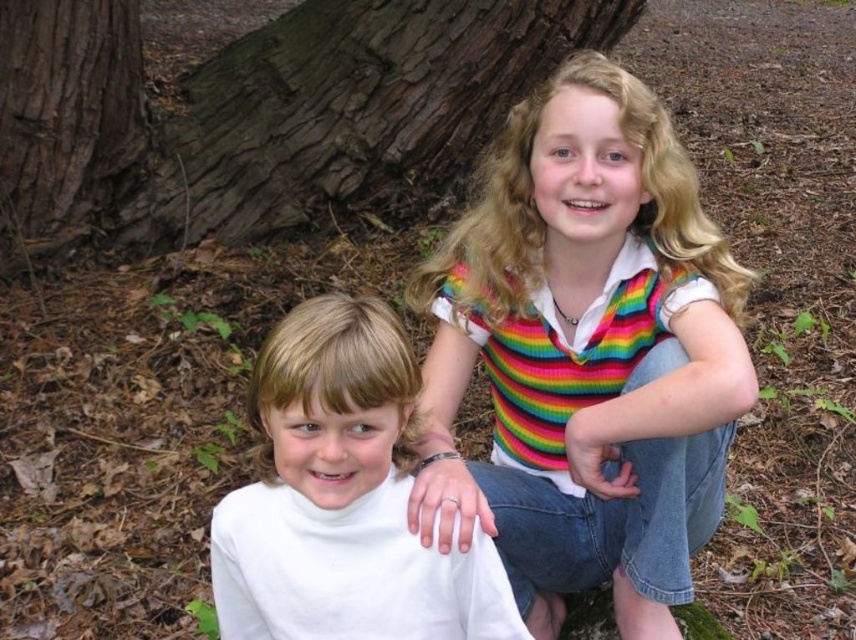
Question: Can you confirm if white matte turtleneck shirt at center is positioned to the right of brown rough tree trunk at left?

Choices:
 (A) yes
 (B) no

Answer: (A)

Question: Based on their relative distances, which object is nearer to the dark brown textured bark at upper left?

Choices:
 (A) rainbow knitted sweater at center
 (B) white matte turtleneck shirt at center

Answer: (A)

Question: Which point is closer to the camera taking this photo?

Choices:
 (A) (300, 172)
 (B) (129, 148)
 (C) (504, 221)
 (D) (364, 637)

Answer: (D)

Question: Is dark brown textured bark at upper left smaller than brown rough tree trunk at left?

Choices:
 (A) no
 (B) yes

Answer: (A)

Question: Does rainbow knitted sweater at center have a lesser width compared to white matte turtleneck shirt at center?

Choices:
 (A) yes
 (B) no

Answer: (B)

Question: Based on their relative distances, which object is farther from the rainbow knitted sweater at center?

Choices:
 (A) white matte turtleneck shirt at center
 (B) dark brown textured bark at upper left

Answer: (B)